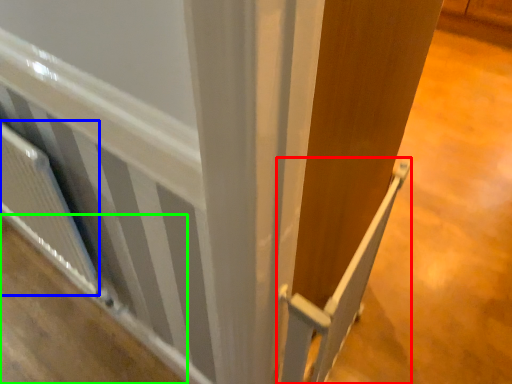
Question: Considering the real-world distances, which object is closest to rail (highlighted by a red box)? radiator (highlighted by a blue box) or plywood (highlighted by a green box).

Choices:
 (A) radiator
 (B) plywood

Answer: (A)